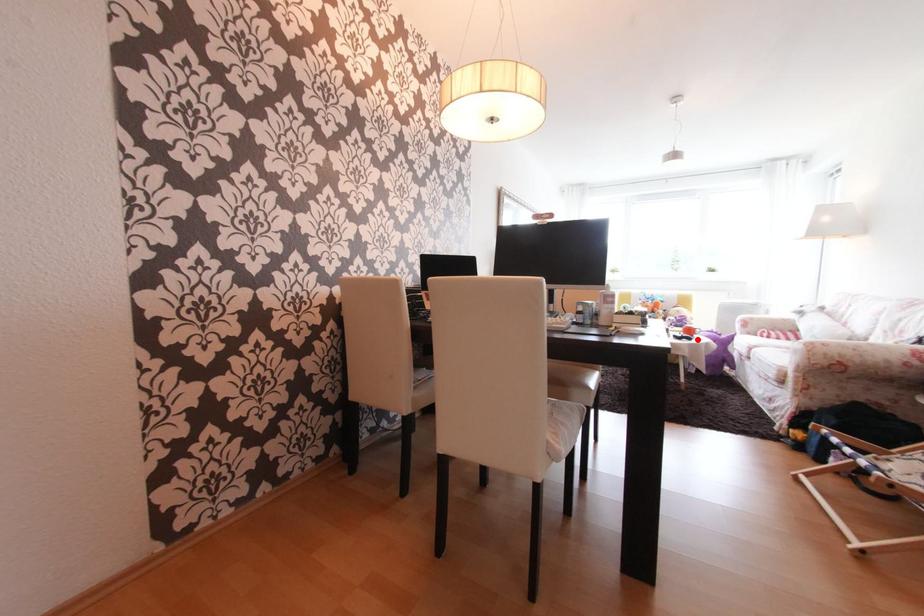
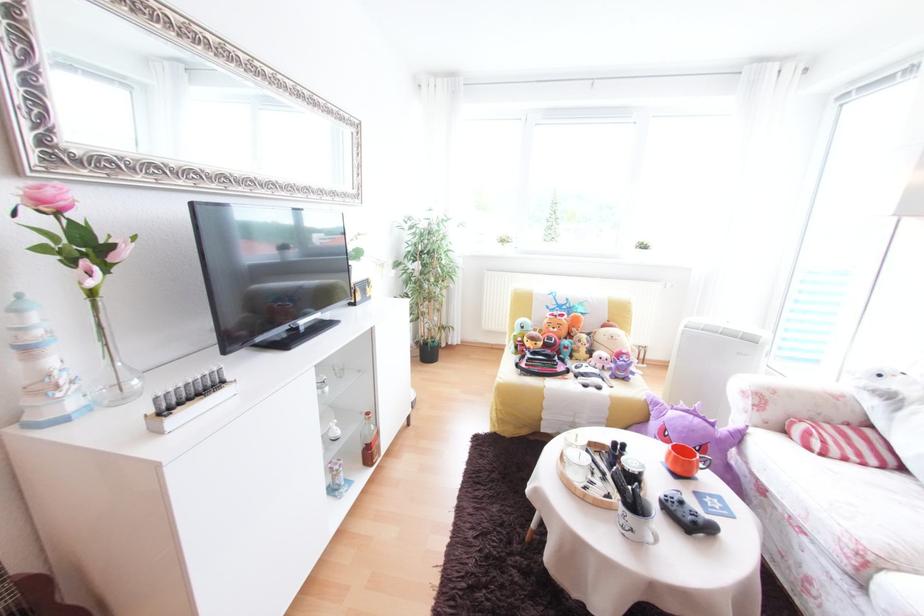
In the second image, find the point that corresponds to the highlighted location in the first image.

(719, 530)